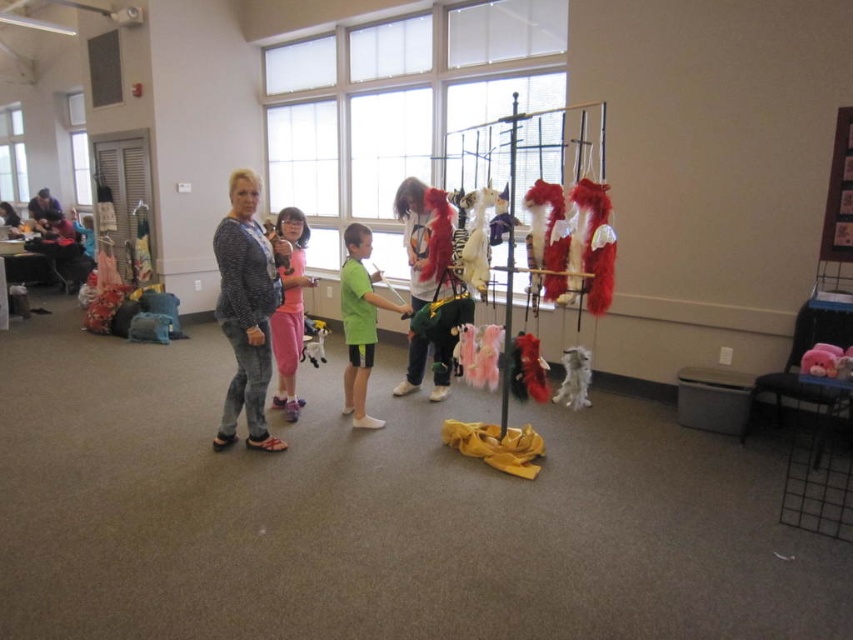
Question: Does tie-dye fabric shirt at center appear over white fluffy dog at center?

Choices:
 (A) yes
 (B) no

Answer: (A)

Question: Which object is positioned closest to the pink plush toy at lower right?

Choices:
 (A) pink cotton dress at center
 (B) white fluffy dog at center

Answer: (B)

Question: Among these points, which one is nearest to the camera?

Choices:
 (A) click(x=242, y=292)
 (B) click(x=556, y=401)
 (C) click(x=805, y=356)
 (D) click(x=291, y=243)

Answer: (C)

Question: Among these objects, which one is farthest from the camera?

Choices:
 (A) tie-dye fabric shirt at center
 (B) speckled sweater at center
 (C) pink plush toy at lower right

Answer: (A)

Question: Can you confirm if tie-dye fabric shirt at center is wider than white fluffy dog at center?

Choices:
 (A) no
 (B) yes

Answer: (B)

Question: Can you confirm if tie-dye fabric shirt at center is positioned to the right of green matte shirt at center?

Choices:
 (A) yes
 (B) no

Answer: (A)